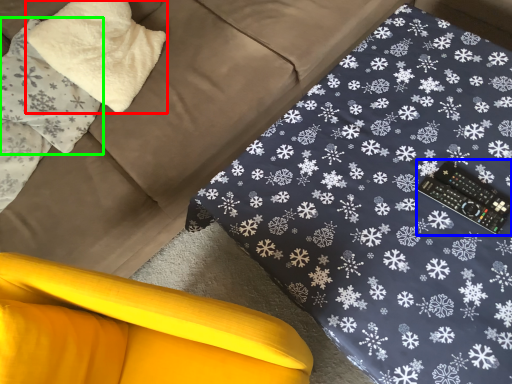
Question: Which object is the farthest from pillow (highlighted by a red box)? Choose among these: control (highlighted by a blue box) or pillow (highlighted by a green box).

Choices:
 (A) control
 (B) pillow

Answer: (A)